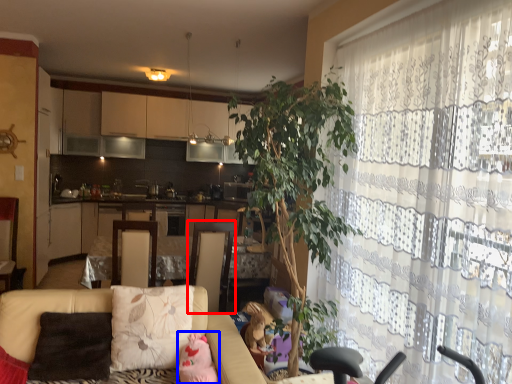
Question: Which point is closer to the camera, swivel chair (highlighted by a red box) or toy (highlighted by a blue box)?

Choices:
 (A) swivel chair
 (B) toy

Answer: (B)